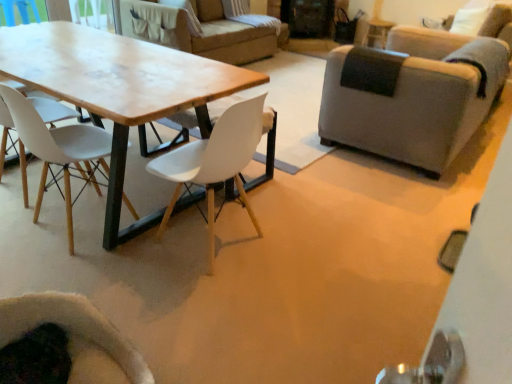
Question: Does white matte chair at center, the 2th chair in the right-to-left sequence, come in front of velvet dark green armchair at lower left, which is the 2th chair in left-to-right order?

Choices:
 (A) no
 (B) yes

Answer: (A)

Question: Is white matte chair at center, the 2th chair in the right-to-left sequence, bigger than velvet dark green armchair at lower left, which is the 2th chair in left-to-right order?

Choices:
 (A) no
 (B) yes

Answer: (B)

Question: Is white matte chair at center, positioned as the 3th chair in left-to-right order, turned away from velvet dark green armchair at lower left, which is the third chair from right to left?

Choices:
 (A) yes
 (B) no

Answer: (B)

Question: Is white matte chair at center, positioned as the 3th chair in left-to-right order, thinner than velvet dark green armchair at lower left, which is the 2th chair in left-to-right order?

Choices:
 (A) no
 (B) yes

Answer: (A)

Question: Can you confirm if white matte chair at center, positioned as the 3th chair in left-to-right order, is shorter than velvet dark green armchair at lower left, which is the third chair from right to left?

Choices:
 (A) no
 (B) yes

Answer: (A)

Question: In terms of height, does white matte chair at center, the 2th chair in the right-to-left sequence, look taller or shorter compared to velvet dark green armchair at lower left, which is the third chair from right to left?

Choices:
 (A) short
 (B) tall

Answer: (B)

Question: Which is correct: white matte chair at center, the 2th chair in the right-to-left sequence, is inside velvet dark green armchair at lower left, which is the third chair from right to left, or outside of it?

Choices:
 (A) inside
 (B) outside

Answer: (B)

Question: From a real-world perspective, is white matte chair at center, positioned as the 3th chair in left-to-right order, above or below velvet dark green armchair at lower left, which is the 2th chair in left-to-right order?

Choices:
 (A) above
 (B) below

Answer: (A)

Question: Does point (246, 122) appear closer or farther from the camera than point (103, 331)?

Choices:
 (A) farther
 (B) closer

Answer: (A)

Question: From their relative heights in the image, would you say velvet dark green armchair at lower left, which is the 2th chair in left-to-right order, is taller or shorter than white matte chair at center, positioned as the 3th chair in left-to-right order?

Choices:
 (A) short
 (B) tall

Answer: (A)

Question: Is velvet dark green armchair at lower left, which is the third chair from right to left, bigger or smaller than white matte chair at center, the 2th chair in the right-to-left sequence?

Choices:
 (A) small
 (B) big

Answer: (A)

Question: Visually, is velvet dark green armchair at lower left, which is the 2th chair in left-to-right order, positioned to the left or to the right of white matte chair at center, positioned as the 3th chair in left-to-right order?

Choices:
 (A) left
 (B) right

Answer: (A)

Question: From a real-world perspective, relative to white matte chair at center, positioned as the 3th chair in left-to-right order, is velvet dark green armchair at lower left, which is the third chair from right to left, vertically above or below?

Choices:
 (A) above
 (B) below

Answer: (B)

Question: From a real-world perspective, is white matte chair at left, which is counted as the fourth chair, starting from the right, above or below velvet dark green armchair at lower left, which is the 2th chair in left-to-right order?

Choices:
 (A) above
 (B) below

Answer: (A)

Question: Is white matte chair at left, which is counted as the fourth chair, starting from the right, taller or shorter than velvet dark green armchair at lower left, which is the third chair from right to left?

Choices:
 (A) tall
 (B) short

Answer: (A)